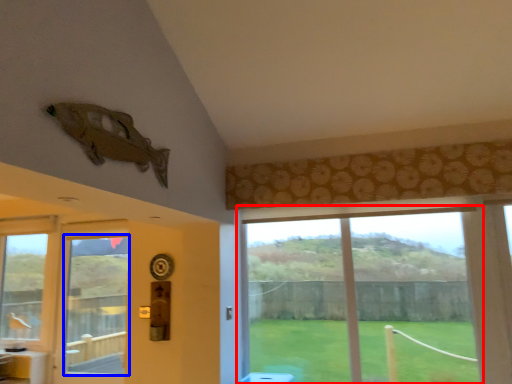
Question: Which of the following is the closest to the observer, window (highlighted by a red box) or window screen (highlighted by a blue box)?

Choices:
 (A) window
 (B) window screen

Answer: (A)